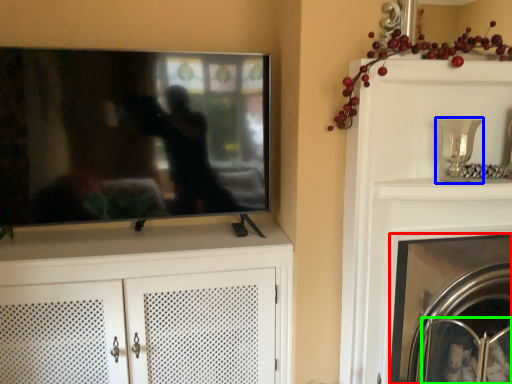
Question: Which object is positioned farthest from fireplace (highlighted by a red box)? Select from candle holder (highlighted by a blue box) and glass door (highlighted by a green box).

Choices:
 (A) candle holder
 (B) glass door

Answer: (A)